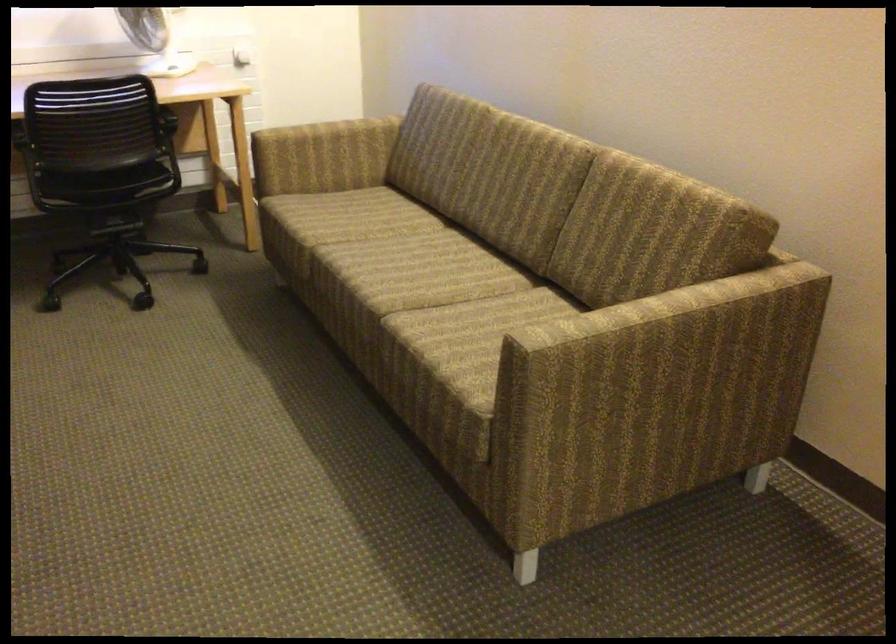
What do you see at coordinates (395, 289) in the screenshot? I see `the sofa sitting surface` at bounding box center [395, 289].